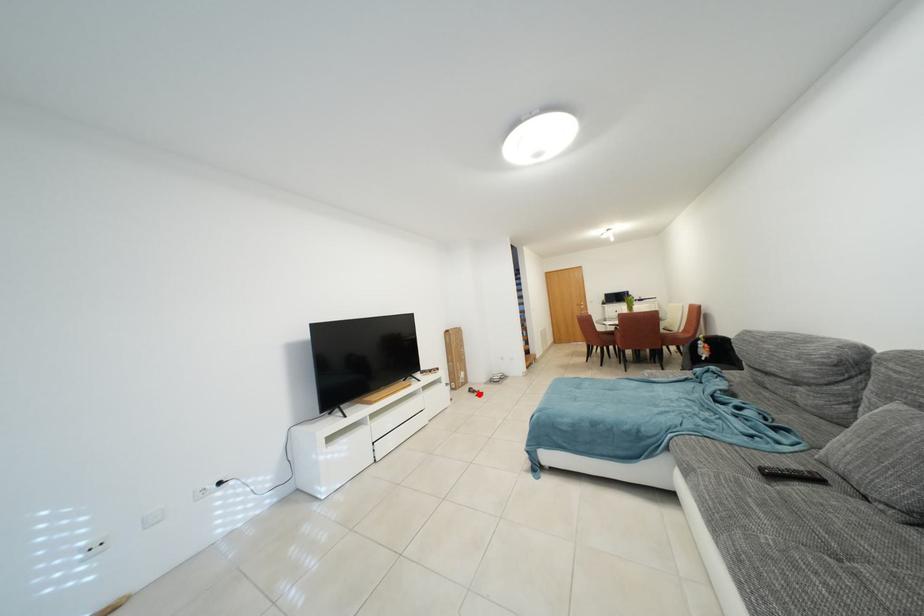
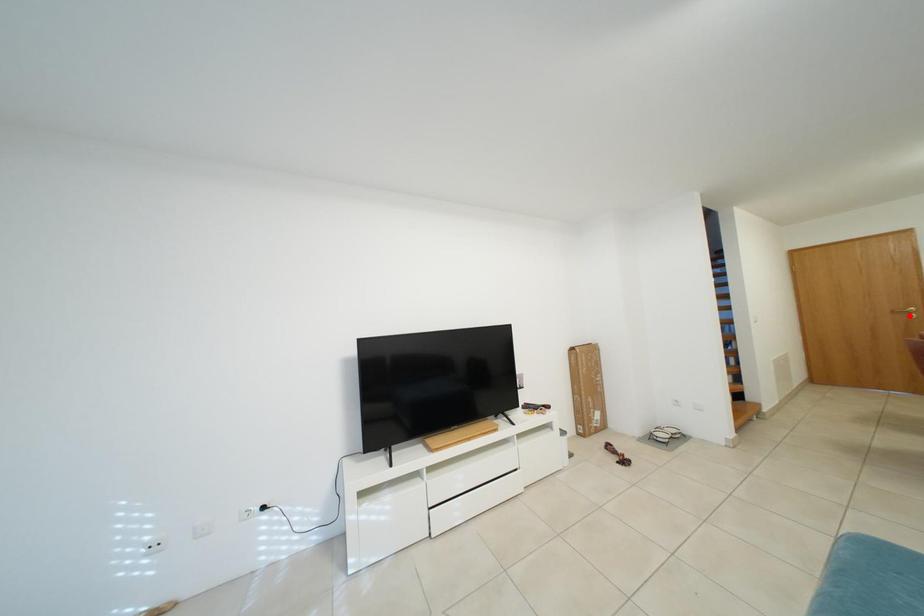
I am providing you with two images of the same scene from different viewpoints. A red point is marked on the first image and another point is marked on the second image. Is the marked point in image1 the same physical position as the marked point in image2?

No